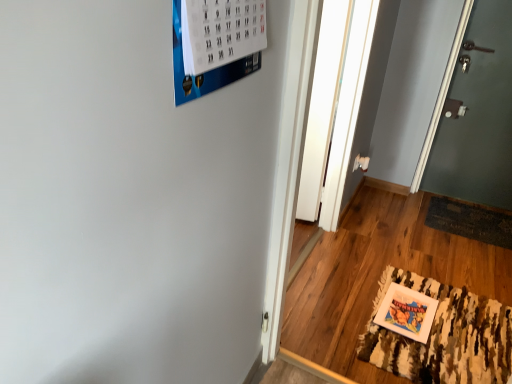
Identify the location of transparent glass door at center. The width and height of the screenshot is (512, 384). (323, 104).

Measure the distance between dark brown woven mat at lower right and camera.

A distance of 7.52 feet exists between dark brown woven mat at lower right and camera.

The height and width of the screenshot is (384, 512). Identify the location of white matte picture frame at lower right. (407, 312).

Where is `camouflage-patterned rug at lower right`? The image size is (512, 384). camouflage-patterned rug at lower right is located at coordinates (443, 337).

From a real-world perspective, is white matte picture frame at lower right located higher than transparent glass door at center?

Incorrect, from a real-world perspective, white matte picture frame at lower right is lower than transparent glass door at center.

Can you confirm if white matte picture frame at lower right is thinner than transparent glass door at center?

No.

From the image's perspective, which is below, white matte picture frame at lower right or transparent glass door at center?

white matte picture frame at lower right is shown below in the image.

Who is smaller, white matte picture frame at lower right or transparent glass door at center?

Smaller between the two is white matte picture frame at lower right.

Which object is closer to the camera taking this photo, camouflage-patterned rug at lower right or dark brown woven mat at lower right?

camouflage-patterned rug at lower right is in front.

Which object is thinner, camouflage-patterned rug at lower right or dark brown woven mat at lower right?

With smaller width is dark brown woven mat at lower right.

Is point (489, 360) positioned in front of point (449, 214)?

Yes, point (489, 360) is in front of point (449, 214).

From the image's perspective, which one is positioned higher, camouflage-patterned rug at lower right or dark brown woven mat at lower right?

dark brown woven mat at lower right is shown above in the image.

I want to click on glass door on the left of green matte door at right, so click(x=323, y=104).

Is green matte door at right not inside transparent glass door at center?

Yes, green matte door at right is located beyond the bounds of transparent glass door at center.

Between green matte door at right and transparent glass door at center, which one has larger size?

green matte door at right is bigger.

Is green matte door at right to the right of transparent glass door at center from the viewer's perspective?

Yes, green matte door at right is to the right of transparent glass door at center.

Based on the photo, from a real-world perspective, who is located lower, transparent glass door at center or camouflage-patterned rug at lower right?

camouflage-patterned rug at lower right, from a real-world perspective.

Based on the photo, is transparent glass door at center at the left side of camouflage-patterned rug at lower right?

Correct, you'll find transparent glass door at center to the left of camouflage-patterned rug at lower right.

Is transparent glass door at center turned away from camouflage-patterned rug at lower right?

No, camouflage-patterned rug at lower right is not at the back of transparent glass door at center.

Is transparent glass door at center not inside camouflage-patterned rug at lower right?

Absolutely, transparent glass door at center is external to camouflage-patterned rug at lower right.

How distant is transparent glass door at center from dark brown woven mat at lower right?

The distance of transparent glass door at center from dark brown woven mat at lower right is 37.35 inches.

Does point (333, 17) come behind point (441, 217)?

No, it is in front of (441, 217).

Is transparent glass door at center at the left side of dark brown woven mat at lower right?

Yes, transparent glass door at center is to the left of dark brown woven mat at lower right.

Considering the sizes of objects transparent glass door at center and dark brown woven mat at lower right in the image provided, who is shorter, transparent glass door at center or dark brown woven mat at lower right?

dark brown woven mat at lower right.

Between transparent glass door at center and white matte picture frame at lower right, which one appears on the left side from the viewer's perspective?

From the viewer's perspective, transparent glass door at center appears more on the left side.

In the image, is transparent glass door at center positioned in front of or behind white matte picture frame at lower right?

transparent glass door at center is behind white matte picture frame at lower right.

The image size is (512, 384). I want to click on picture frame below the transparent glass door at center (from a real-world perspective), so click(x=407, y=312).

Can you confirm if camouflage-patterned rug at lower right is wider than transparent glass door at center?

Correct, the width of camouflage-patterned rug at lower right exceeds that of transparent glass door at center.

Which is behind, camouflage-patterned rug at lower right or transparent glass door at center?

transparent glass door at center is behind.

Does camouflage-patterned rug at lower right have a smaller size compared to transparent glass door at center?

No.

From the picture: From the image's perspective, is camouflage-patterned rug at lower right positioned above or below transparent glass door at center?

camouflage-patterned rug at lower right is situated lower than transparent glass door at center in the image.

This screenshot has width=512, height=384. In order to click on picture frame lying on the right of transparent glass door at center in this screenshot , I will do `click(407, 312)`.

Where is `mat that is under the dark brown woven mat at lower right (from a real-world perspective)`? Image resolution: width=512 pixels, height=384 pixels. mat that is under the dark brown woven mat at lower right (from a real-world perspective) is located at coordinates (443, 337).

Estimate the real-world distances between objects in this image. Which object is further from transparent glass door at center, camouflage-patterned rug at lower right or white matte picture frame at lower right?

camouflage-patterned rug at lower right is positioned further to the anchor transparent glass door at center.

Looking at the image, which one is located closer to white matte picture frame at lower right, dark brown woven mat at lower right or camouflage-patterned rug at lower right?

Based on the image, camouflage-patterned rug at lower right appears to be nearer to white matte picture frame at lower right.

Estimate the real-world distances between objects in this image. Which object is closer to dark brown woven mat at lower right, camouflage-patterned rug at lower right or transparent glass door at center?

The object closer to dark brown woven mat at lower right is camouflage-patterned rug at lower right.

Considering their positions, is white matte picture frame at lower right positioned closer to green matte door at right than dark brown woven mat at lower right?

dark brown woven mat at lower right.

From the image, which object appears to be farther from dark brown woven mat at lower right, green matte door at right or transparent glass door at center?

Based on the image, transparent glass door at center appears to be further to dark brown woven mat at lower right.

Estimate the real-world distances between objects in this image. Which object is further from camouflage-patterned rug at lower right, green matte door at right or white matte picture frame at lower right?

green matte door at right.

From the image, which object appears to be nearer to green matte door at right, camouflage-patterned rug at lower right or white matte picture frame at lower right?

camouflage-patterned rug at lower right.

Estimate the real-world distances between objects in this image. Which object is closer to green matte door at right, white matte picture frame at lower right or camouflage-patterned rug at lower right?

camouflage-patterned rug at lower right is closer to green matte door at right.

This screenshot has width=512, height=384. Find the location of `picture frame between camouflage-patterned rug at lower right and dark brown woven mat at lower right along the z-axis`. picture frame between camouflage-patterned rug at lower right and dark brown woven mat at lower right along the z-axis is located at coordinates (407, 312).

Identify the location of picture frame situated between transparent glass door at center and green matte door at right from left to right. This screenshot has width=512, height=384. (407, 312).

This screenshot has width=512, height=384. I want to click on doormat that lies between green matte door at right and camouflage-patterned rug at lower right from top to bottom, so click(470, 221).

The height and width of the screenshot is (384, 512). What are the coordinates of `picture frame between green matte door at right and camouflage-patterned rug at lower right in the up-down direction` in the screenshot? It's located at pos(407,312).